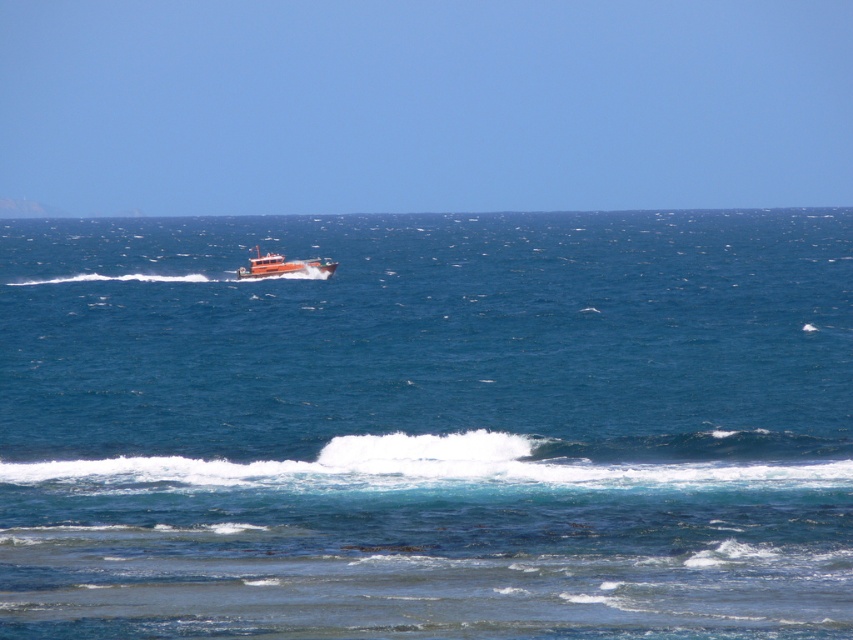
You are standing on the shore looking at the seascape. The white frothy wave at lower center and the orange matte boat at center are both visible. Which object is closer to the water surface?

The white frothy wave at lower center is positioned under the orange matte boat at center, so the white frothy wave at lower center is closer to the water surface.

You are a surfer planning to catch a wave. You see the blue water at center and the white frothy wave at lower center. Which one is closer to you?

The white frothy wave at lower center is closer to you because it is positioned lower in the image, typically indicating proximity in such scenes.